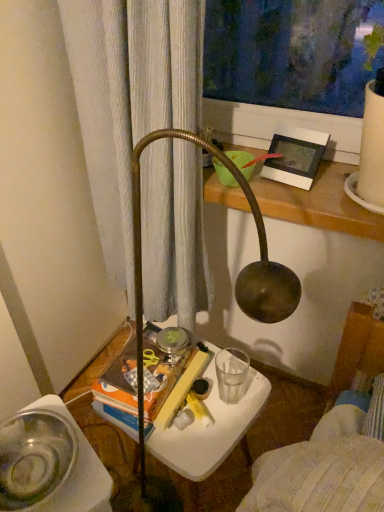
Question: Looking at their shapes, would you say white plastic picture frame at upper right is wider or thinner than white plastic table at center?

Choices:
 (A) thin
 (B) wide

Answer: (A)

Question: Is point 309,147 closer or farther from the camera than point 218,417?

Choices:
 (A) farther
 (B) closer

Answer: (B)

Question: Based on their relative distances, which object is farther from the white plastic picture frame at upper right?

Choices:
 (A) clear glass water at lower center
 (B) white plastic table at center
 (C) metallic silver bowl at lower left

Answer: (C)

Question: Which object is positioned farthest from the clear glass water at lower center?

Choices:
 (A) white plastic picture frame at upper right
 (B) metallic silver bowl at lower left
 (C) white plastic table at center

Answer: (A)